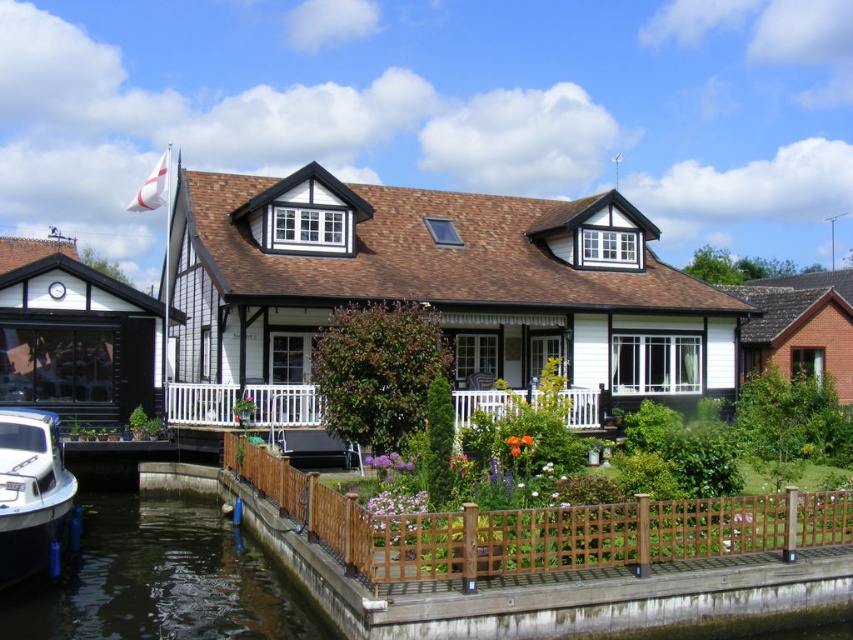
Question: Is white glossy boat at lower left thinner than white wooden porch at center?

Choices:
 (A) no
 (B) yes

Answer: (B)

Question: Can you confirm if dark brown water at lower left is positioned to the right of white glossy boat at lower left?

Choices:
 (A) no
 (B) yes

Answer: (B)

Question: Which point is farther from the camera taking this photo?

Choices:
 (A) (48, 465)
 (B) (454, 400)
 (C) (166, 618)

Answer: (B)

Question: Considering the real-world distances, which object is closest to the white wooden porch at center?

Choices:
 (A) white glossy boat at lower left
 (B) dark brown water at lower left

Answer: (B)

Question: Considering the relative positions of dark brown water at lower left and white wooden porch at center in the image provided, where is dark brown water at lower left located with respect to white wooden porch at center?

Choices:
 (A) below
 (B) above

Answer: (A)

Question: Which point is closer to the camera taking this photo?

Choices:
 (A) (207, 636)
 (B) (170, 416)
 (C) (9, 486)

Answer: (A)